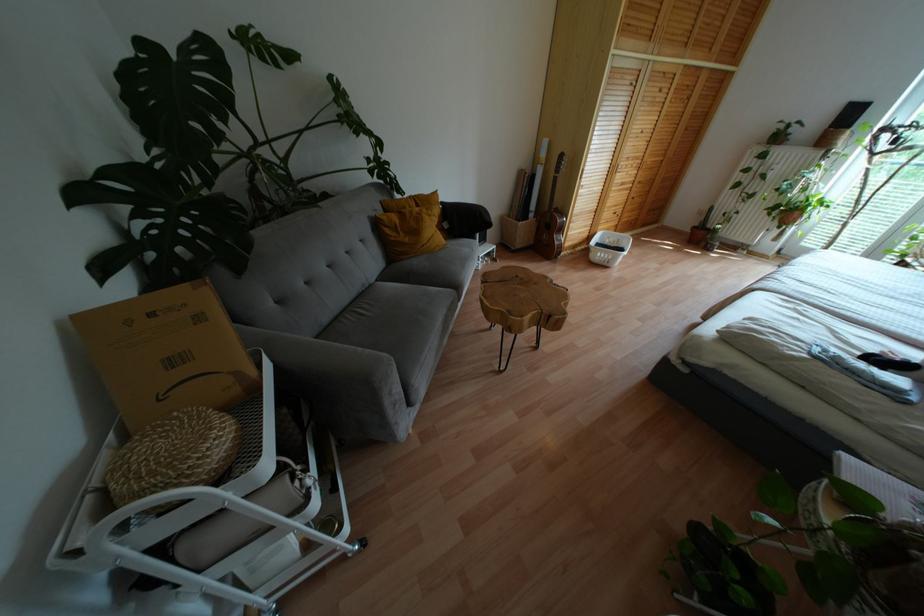
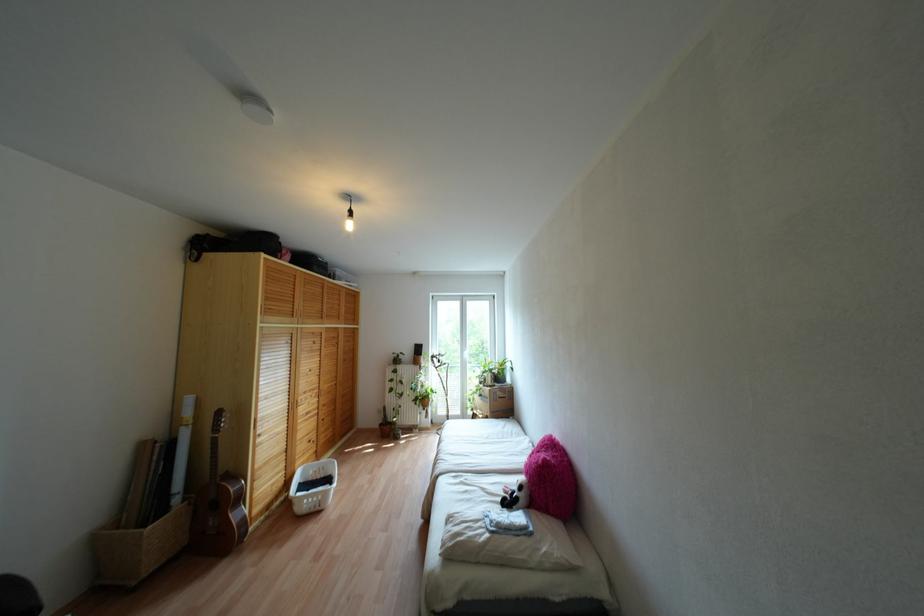
The point at (x=560, y=229) is marked in the first image. Where is the corresponding point in the second image?

(238, 498)